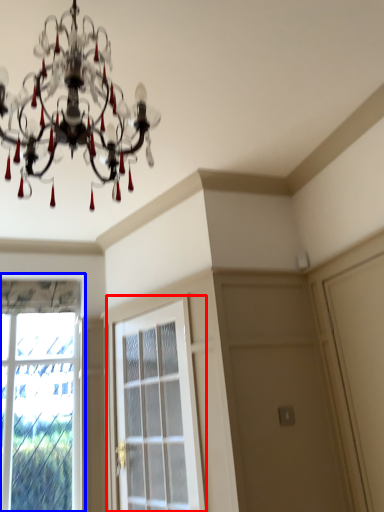
Question: Among these objects, which one is farthest to the camera, screen door (highlighted by a red box) or window (highlighted by a blue box)?

Choices:
 (A) screen door
 (B) window

Answer: (B)